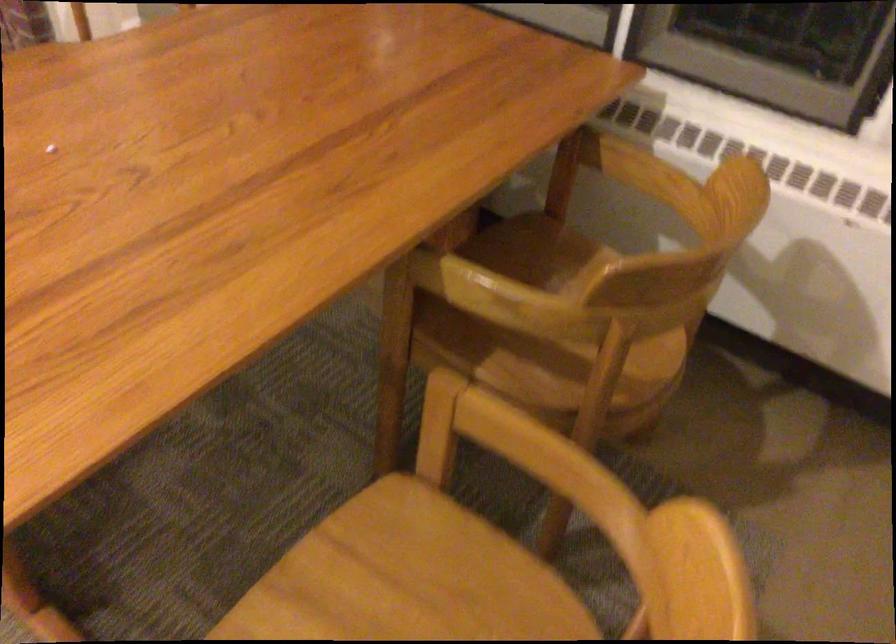
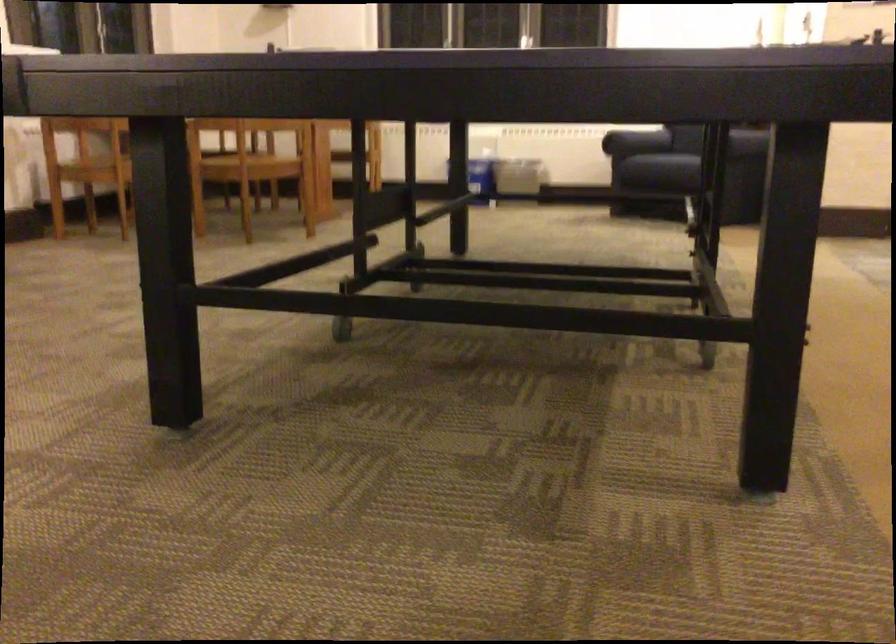
Question: I am providing you with two images of the same scene from different viewpoints. Please identify which objects are invisible in image2.

Choices:
 (A) chair sitting surface
 (B) wooden chair sitting surface
 (C) white dispenser pump
 (D) sofa sitting surface

Answer: (B)